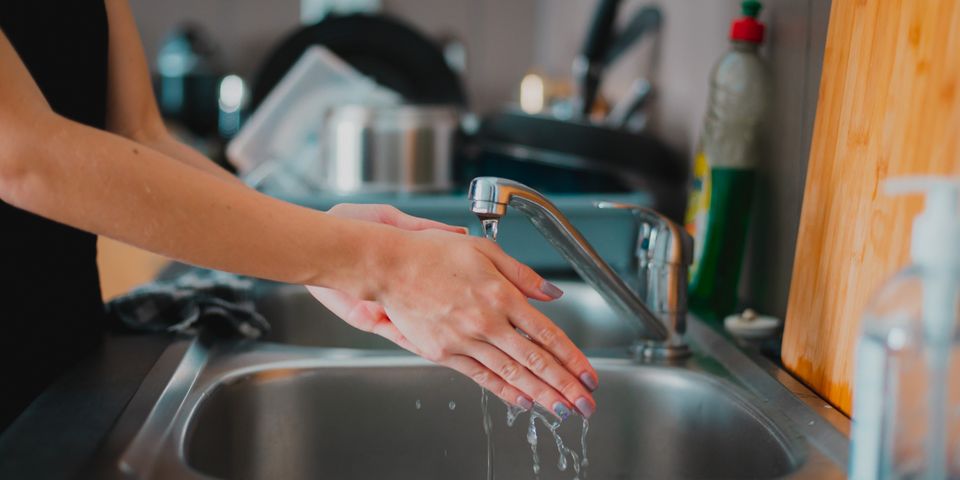
Locate an element on the screen. drain stopper is located at coordinates (759, 320).